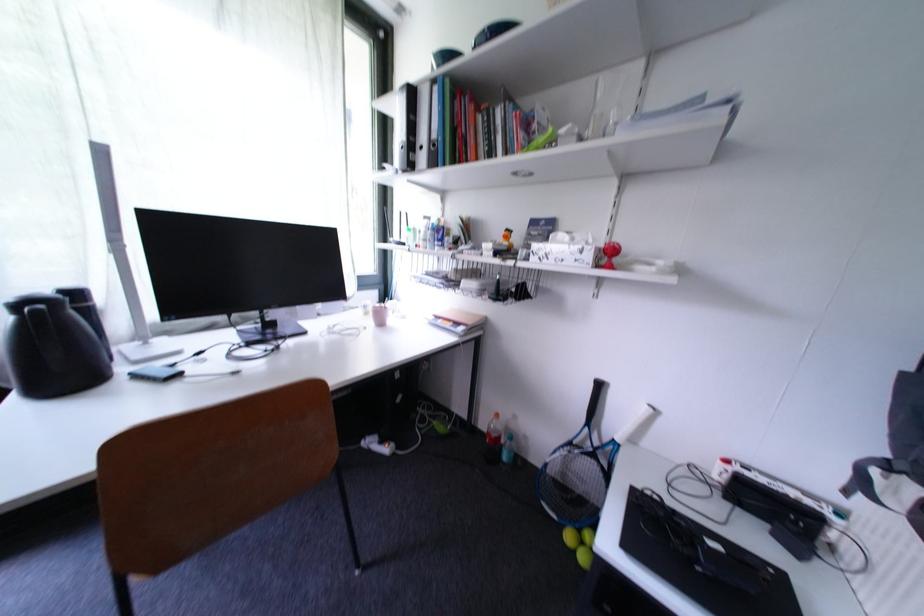
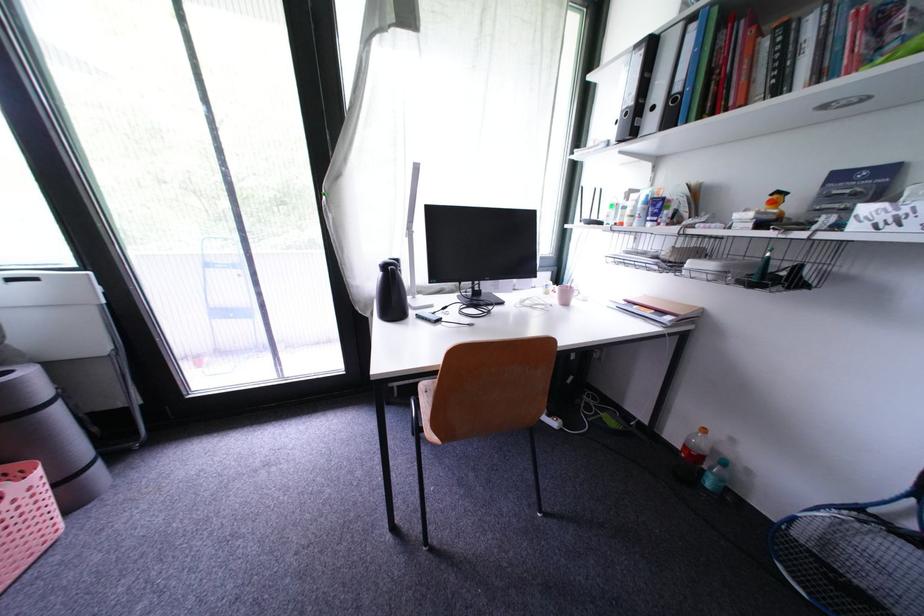
Where in the second image is the point corresponding to (514,460) from the first image?

(718, 485)